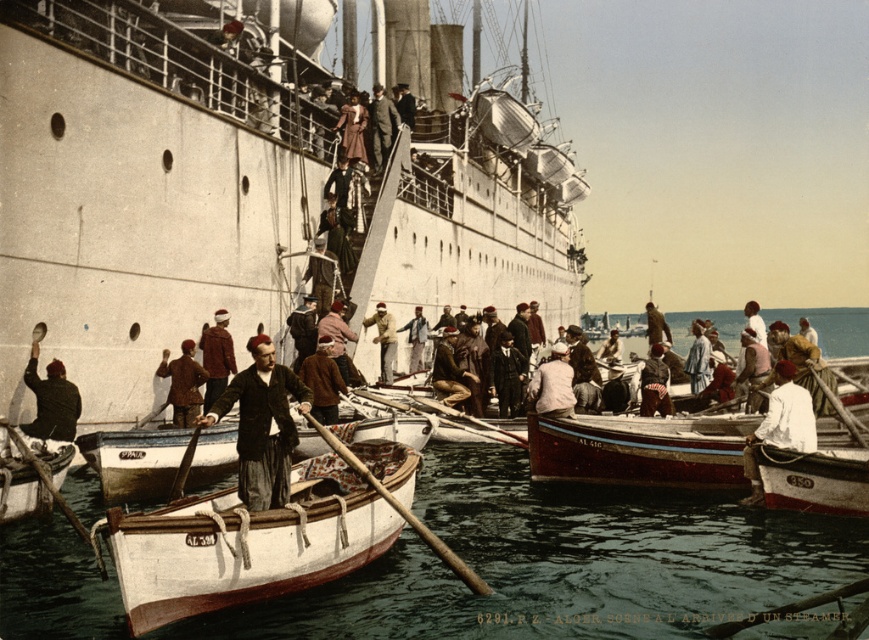
Is clear blue water at center positioned before matte brown coat at center?

Yes.

Where is `clear blue water at center`? This screenshot has width=869, height=640. clear blue water at center is located at coordinates (562, 561).

This screenshot has height=640, width=869. Describe the element at coordinates (562, 561) in the screenshot. I see `clear blue water at center` at that location.

At what (x,y) coordinates should I click in order to perform the action: click on clear blue water at center. Please return your answer as a coordinate pair (x, y). The width and height of the screenshot is (869, 640). Looking at the image, I should click on (562, 561).

Where is `white cotton shirt at center`? The height and width of the screenshot is (640, 869). white cotton shirt at center is located at coordinates (780, 424).

The image size is (869, 640). In order to click on white cotton shirt at center in this screenshot , I will do `click(780, 424)`.

Can you confirm if white matte cruise ship at center is positioned below dark brown leather jacket at center?

Actually, white matte cruise ship at center is above dark brown leather jacket at center.

Which is behind, point (275, 99) or point (270, 355)?

Positioned behind is point (275, 99).

Is point (98, 145) less distant than point (280, 433)?

No, it is not.

This screenshot has width=869, height=640. Find the location of `white matte cruise ship at center`. white matte cruise ship at center is located at coordinates (144, 193).